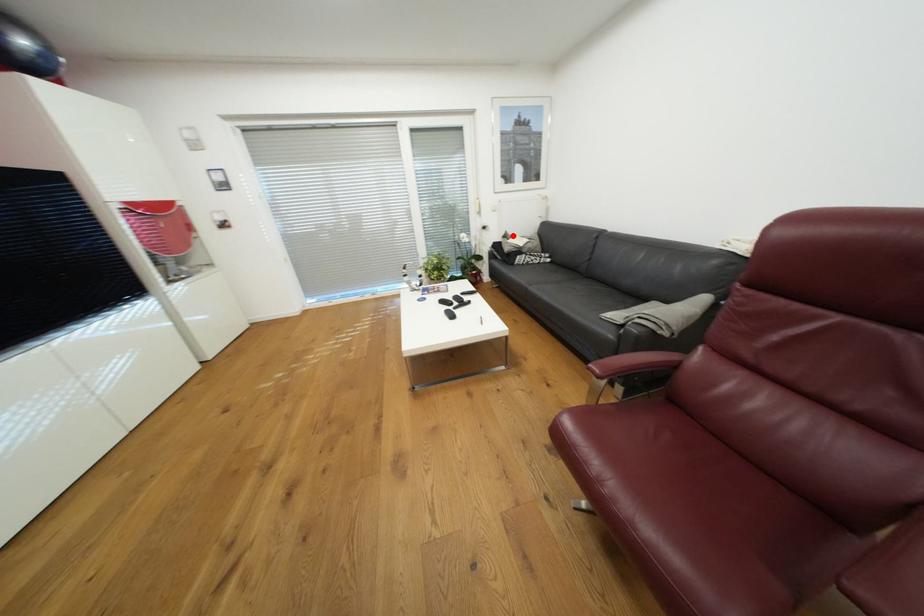
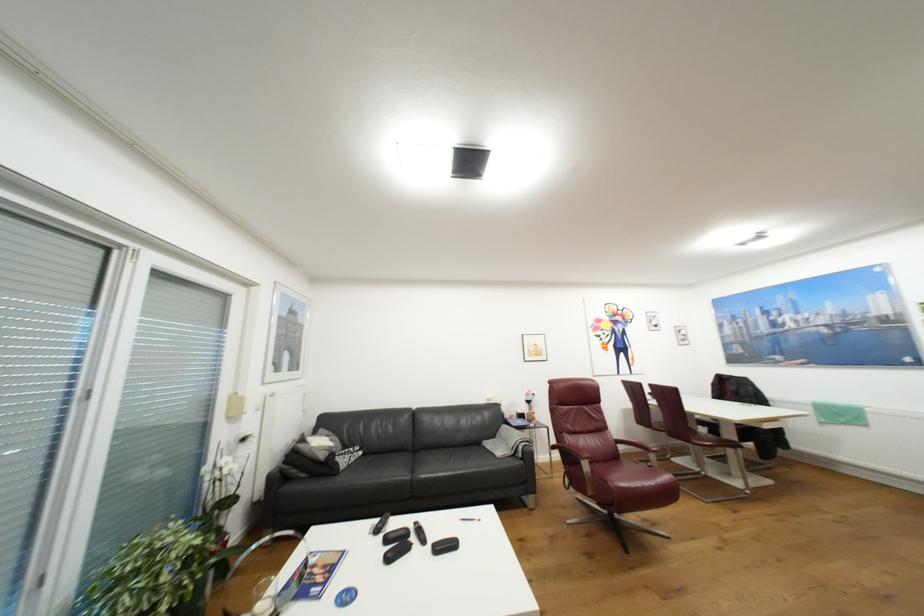
Question: I am providing you with two images of the same scene from different viewpoints. A red point is marked on the first image. At the location where the point appears in image 1, is it still visible in image 2?

Choices:
 (A) Yes
 (B) No

Answer: (A)